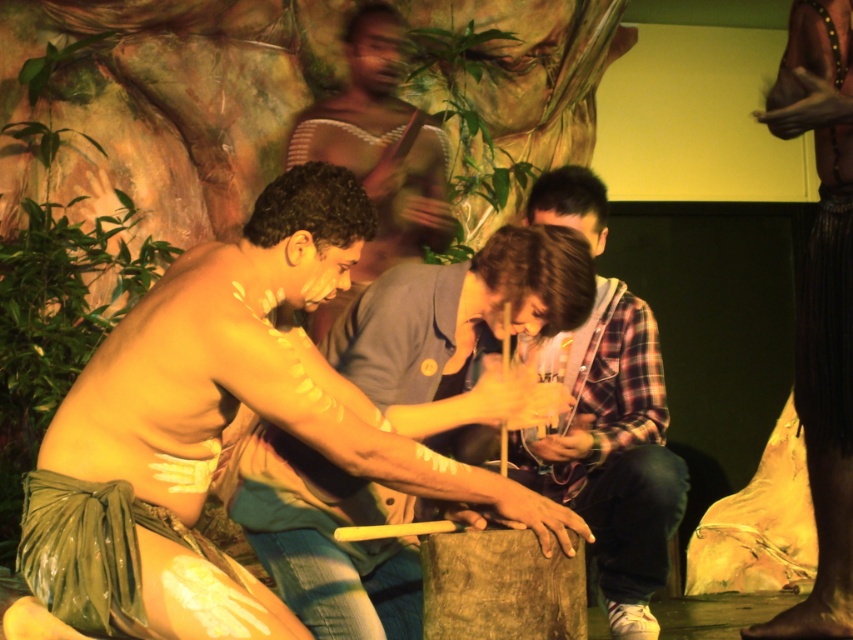
Question: Is green textured cloth at center bigger than smooth skin man at center?

Choices:
 (A) no
 (B) yes

Answer: (A)

Question: Can you confirm if green textured cloth at center is positioned to the left of smooth skin man at center?

Choices:
 (A) no
 (B) yes

Answer: (B)

Question: Which of the following is the farthest from the observer?

Choices:
 (A) (142, 499)
 (B) (368, 42)
 (C) (816, 381)
 (D) (683, 484)

Answer: (B)

Question: Does green textured cloth at center have a smaller size compared to plaid shirt at center?

Choices:
 (A) no
 (B) yes

Answer: (B)

Question: Which object is positioned farthest from the smooth skin man at center?

Choices:
 (A) plaid shirt at center
 (B) green textured cloth at center
 (C) dark brown textured skin at center

Answer: (B)

Question: Among these objects, which one is farthest from the camera?

Choices:
 (A) green textured cloth at center
 (B) dark brown textured skin at center

Answer: (B)